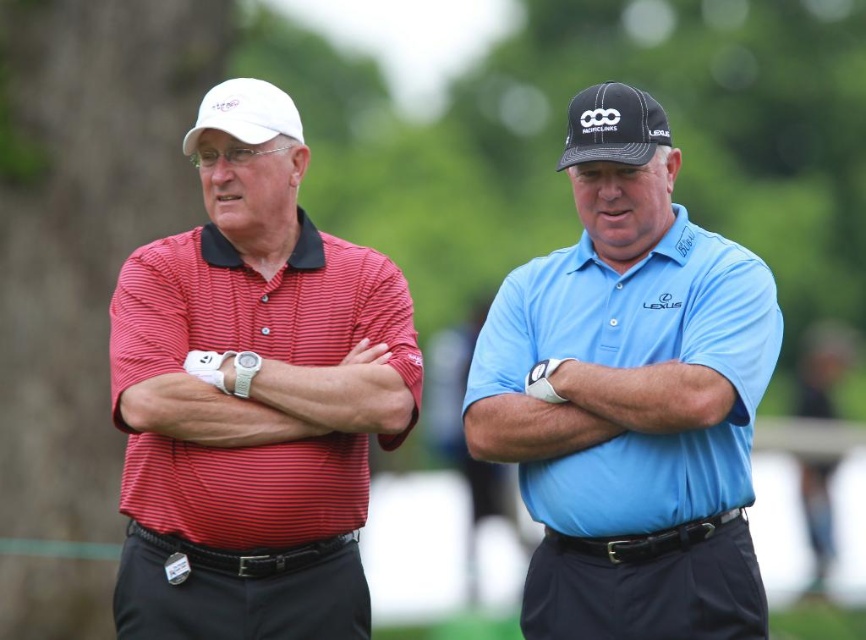
Question: Estimate the real-world distances between objects in this image. Which object is farther from the black textured cap at upper center?

Choices:
 (A) white matte baseball cap at upper left
 (B) matte red striped polo shirt at left
 (C) blue smooth polo shirt at center
 (D) red striped shirt at left

Answer: (A)

Question: Where is black textured cap at upper center located in relation to white matte baseball cap at upper left in the image?

Choices:
 (A) left
 (B) right

Answer: (B)

Question: Does red striped shirt at left have a larger size compared to white matte baseball cap at upper left?

Choices:
 (A) yes
 (B) no

Answer: (A)

Question: Among these objects, which one is farthest from the camera?

Choices:
 (A) matte red striped polo shirt at left
 (B) blue smooth polo shirt at center
 (C) black textured cap at upper center
 (D) red striped shirt at left

Answer: (A)

Question: Can you confirm if matte red striped polo shirt at left is positioned above white matte baseball cap at upper left?

Choices:
 (A) no
 (B) yes

Answer: (A)

Question: Which of the following is the farthest from the observer?

Choices:
 (A) white matte baseball cap at upper left
 (B) red striped shirt at left
 (C) blue smooth polo shirt at center

Answer: (A)